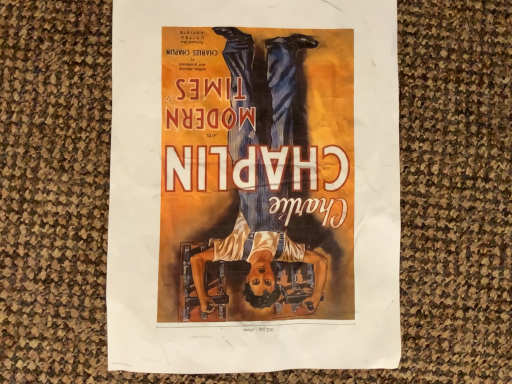
Where is `vacant space situated above matte paper poster at center (from a real-world perspective)`? The height and width of the screenshot is (384, 512). vacant space situated above matte paper poster at center (from a real-world perspective) is located at coordinates (247, 165).